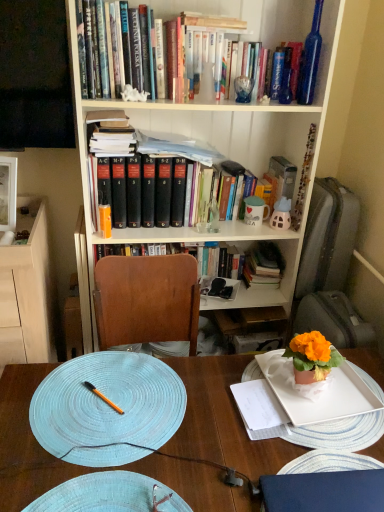
Identify the location of vacant area that lies between orange glossy pen at center and white paper notebook at center. The height and width of the screenshot is (512, 384). (179, 406).